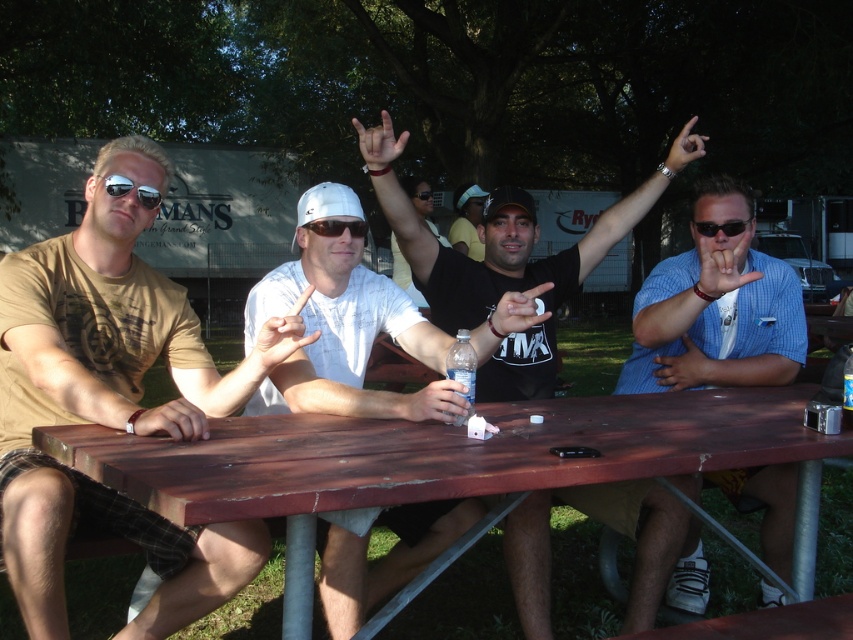
You are standing in front of the picnic table and want to place a small object on the table. If you place it closer to the viewer, which point should you choose between point (148,193) and point (706,227)?

You should choose point (148,193) because it is closer to the viewer than point (706,227).

In the scene shown: You are a photographer taking a picture of the group. You notice the blue checkered shirt at right and the matte white hand at center. Which object is closer to the camera?

The blue checkered shirt at right is located below the matte white hand at center, so the matte white hand at center is closer to the camera.